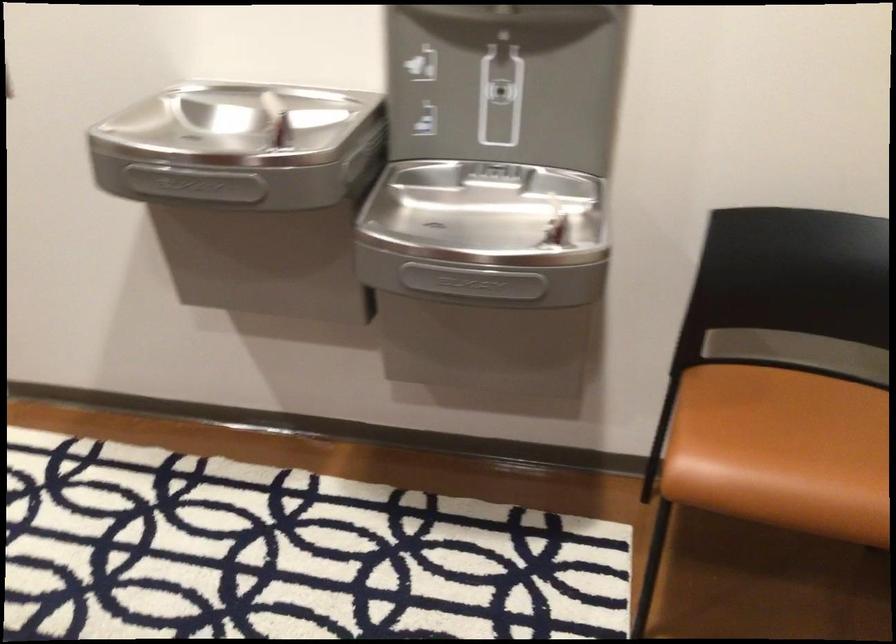
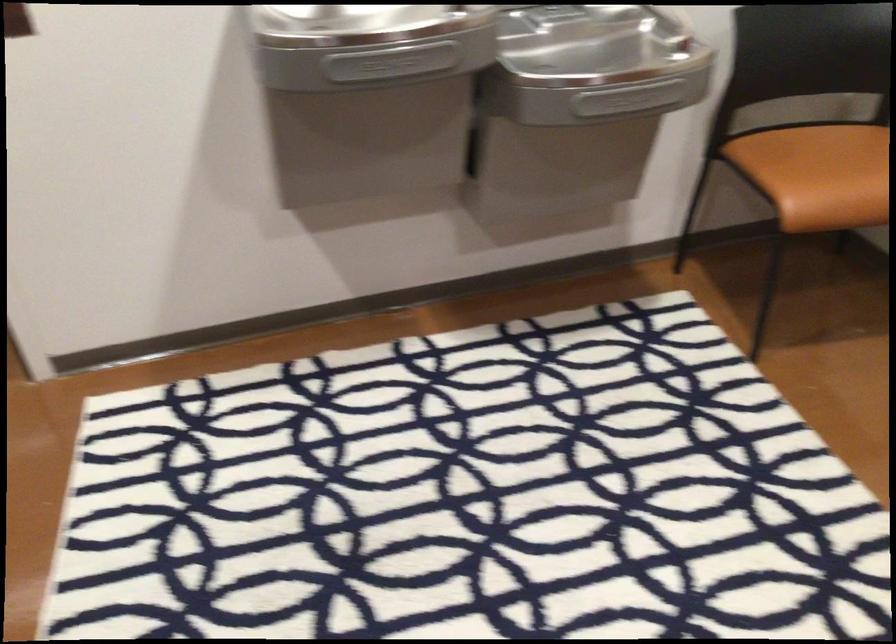
The point at (478, 287) is marked in the first image. Where is the corresponding point in the second image?

(627, 99)